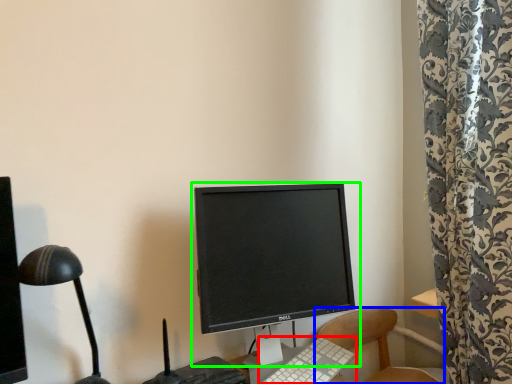
Question: Based on their relative distances, which object is farther from computer keyboard (highlighted by a red box)? Choose from chair (highlighted by a blue box) and computer monitor (highlighted by a green box).

Choices:
 (A) chair
 (B) computer monitor

Answer: (A)